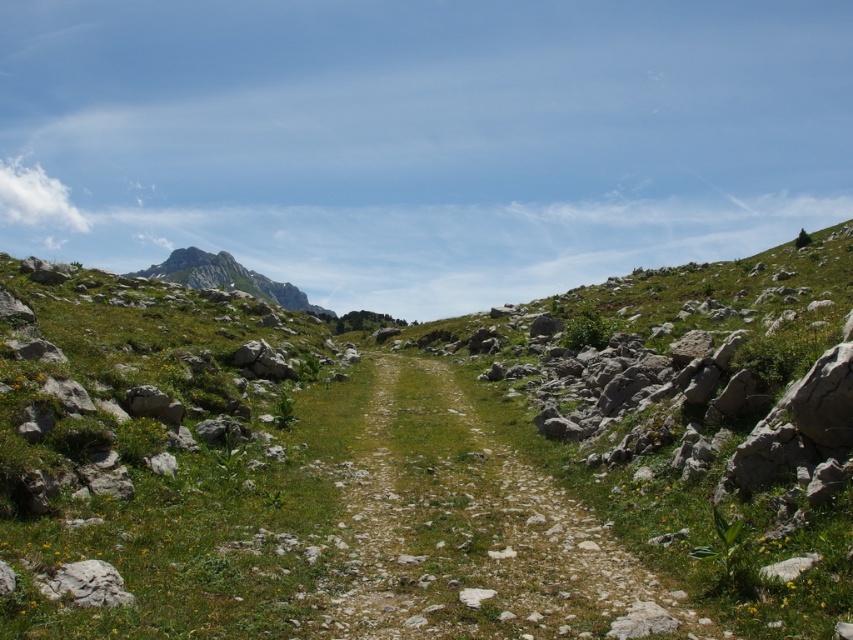
You are a hiker planning to traverse the rugged granite mountain at upper left and the green grassy at center. Which terrain would be easier to walk on?

The green grassy at center would be easier to walk on since it is positioned under the rugged granite mountain at upper left, indicating it is flatter and less steep than the mountain terrain.

You are a hiker standing at the starting point of the path. You see two points marked on the map as point 1 at coordinates point (643, 580) and point 2 at coordinates point (108, 570). Which point is located further away from your current position?

Point (643, 580) is behind point (108, 570), so it is further away from your current position.